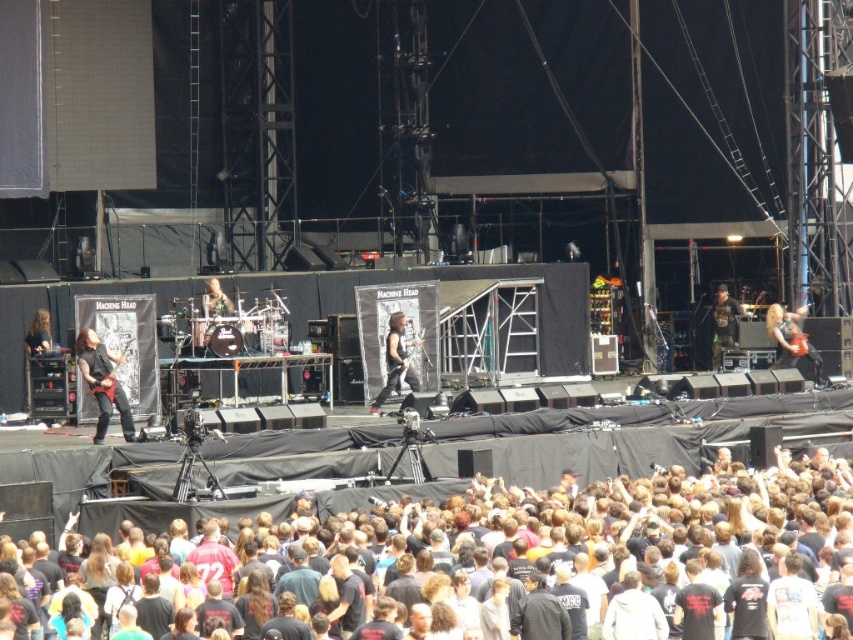
Who is taller, shiny red guitar at right or camouflage jacket at right?

camouflage jacket at right

Which is in front, point (793, 337) or point (734, 330)?

Point (793, 337) is in front.

At what (x,y) coordinates should I click in order to perform the action: click on shiny red guitar at right. Please return your answer as a coordinate pair (x, y). This screenshot has height=640, width=853. Looking at the image, I should click on click(791, 339).

Who is more forward, (393, 358) or (231, 301)?

Positioned in front is point (393, 358).

Who is lower down, shiny black guitar at center or matte black guitar at center?

shiny black guitar at center is lower down.

Looking at this image, measure the distance between shiny black guitar at center and camera.

They are 77.30 meters apart.

At what (x,y) coordinates should I click in order to perform the action: click on shiny black guitar at center. Please return your answer as a coordinate pair (x, y). Looking at the image, I should click on (395, 362).

Measure the distance between shiny black guitar at left and camera.

shiny black guitar at left and camera are 67.09 meters apart.

Is shiny black guitar at left wider than shiny red guitar at right?

Yes.

Is point (99, 404) positioned before point (790, 365)?

Yes, point (99, 404) is closer to viewer.

Locate an element on the screen. shiny black guitar at left is located at coordinates (103, 384).